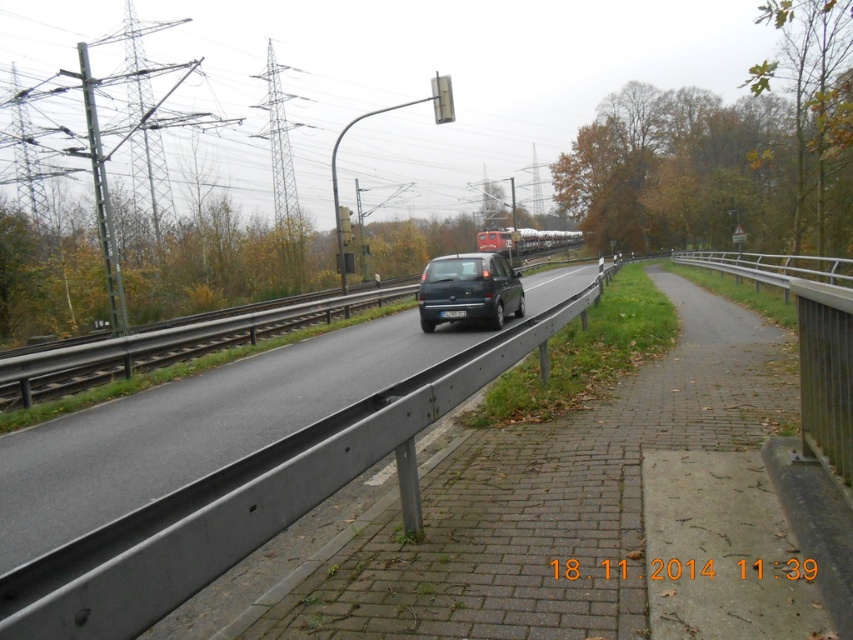
Looking at this image, you are a pedestrian standing at the point marked by the coordinate point [525,240]. You want to cross the road to reach the railway tracks on the left. Is there a safe path to the guardrail on the left side of the road without stepping onto the road itself?

The point [525,240] is on the matte black van at center. Since the guardrail is on the left side of the road, and the van is on the road, there is no safe path to the guardrail without stepping onto the road itself.

You are a photographer standing on the side of the road. You want to take a photo that includes both the metallic gray highway at center and the black asphalt train track at center. Which object will appear shorter in the photo?

The metallic gray highway at center will appear shorter in the photo because it has a lesser height compared to the black asphalt train track at center.